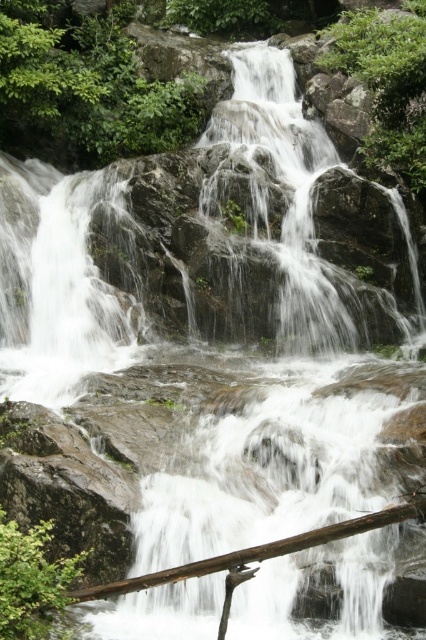
From the picture: You are standing at the base of the waterfall and want to reach a hidden cave located at point (380,522). There is an obstacle at point (86,324). Will you encounter the obstacle before reaching the cave?

Point (86,324) is behind point (380,522), so you will not encounter the obstacle at point (86,324) before reaching the cave located at point (380,522).

You are standing at the edge of the waterfall and see a point labeled as point (57,282). Based on the scene description, can you determine what surface this point is located on?

The point (57,282) is on the white smooth waterfall at left, which is part of the cascading water flowing over the rocky terrain.